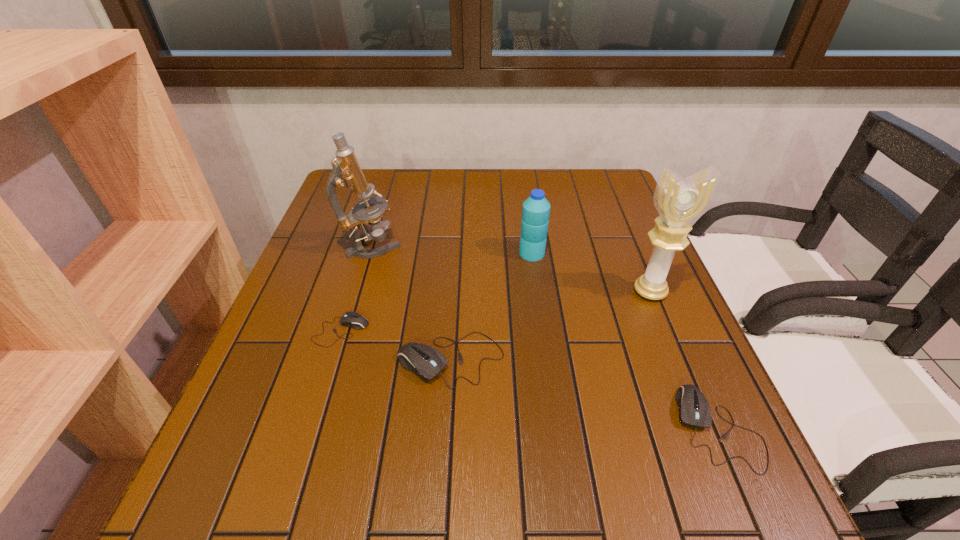
Where is `object located in the near right corner section of the desktop`? object located in the near right corner section of the desktop is located at coordinates (694, 410).

The width and height of the screenshot is (960, 540). Find the location of `free location at the far edge`. free location at the far edge is located at coordinates (436, 209).

The image size is (960, 540). I want to click on free space at the near edge of the desktop, so click(x=392, y=426).

You are a GUI agent. You are given a task and a screenshot of the screen. Output one action in this format:
    pyautogui.click(x=<x>, y=<y>)
    Task: Click on the free space at the left edge of the desktop
    The height and width of the screenshot is (540, 960).
    Given the screenshot: What is the action you would take?
    pyautogui.click(x=346, y=262)

The width and height of the screenshot is (960, 540). I want to click on vacant space at the right edge of the desktop, so click(632, 289).

This screenshot has width=960, height=540. What are the coordinates of `free region at the near left corner of the desktop` in the screenshot? It's located at (259, 444).

This screenshot has width=960, height=540. Identify the location of vacant space at the far right corner of the desktop. (580, 190).

Locate an element on the screen. The image size is (960, 540). vacant area that lies between the third object from left to right and the second tallest computer mouse is located at coordinates (585, 394).

Where is `empty space that is in between the award and the water bottle`? This screenshot has height=540, width=960. empty space that is in between the award and the water bottle is located at coordinates (591, 272).

The width and height of the screenshot is (960, 540). I want to click on free spot between the third farthest object and the microscope, so click(512, 268).